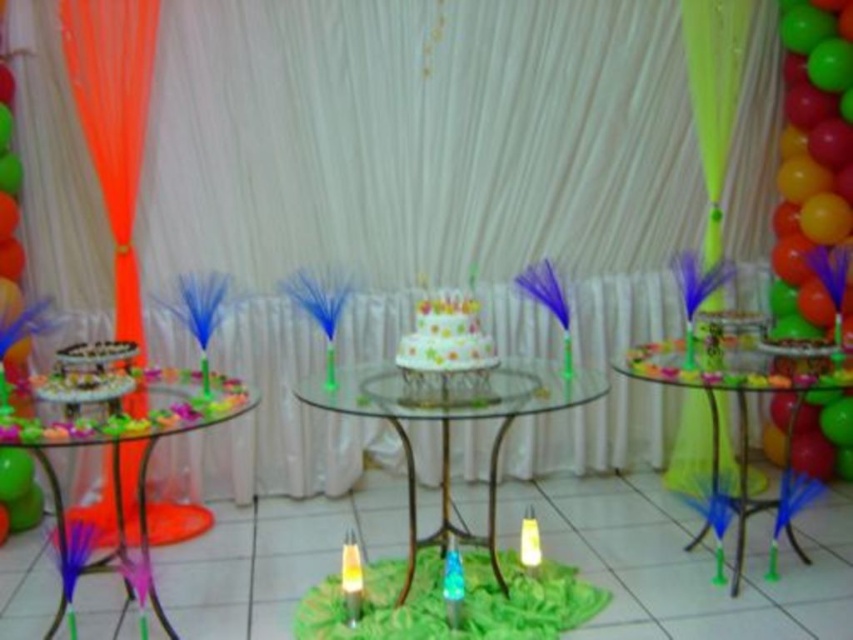
Does translucent glass table at center appear under white glossy cake at center?

Correct, translucent glass table at center is located below white glossy cake at center.

Is translucent glass table at center thinner than white glossy cake at center?

No, translucent glass table at center is not thinner than white glossy cake at center.

In order to click on translucent glass table at center in this screenshot , I will do `click(735, 400)`.

Where is `translucent glass table at center`? translucent glass table at center is located at coordinates [x=735, y=400].

Is translucent glass table at center above white matte candle at center?

Indeed, translucent glass table at center is positioned over white matte candle at center.

Does translucent glass table at center have a greater height compared to white matte candle at center?

Yes.

Does point (840, 387) come farther from viewer compared to point (521, 556)?

No, (840, 387) is closer to viewer.

The width and height of the screenshot is (853, 640). Identify the location of translucent glass table at center. (735, 400).

Between translucent glass table at center and yellow translucent candle at center, which one appears on the right side from the viewer's perspective?

translucent glass table at center

This screenshot has height=640, width=853. What do you see at coordinates (735, 400) in the screenshot?
I see `translucent glass table at center` at bounding box center [735, 400].

Is point (698, 381) positioned behind point (350, 579)?

No, it is in front of (350, 579).

What are the coordinates of `translucent glass table at center` in the screenshot? It's located at (735, 400).